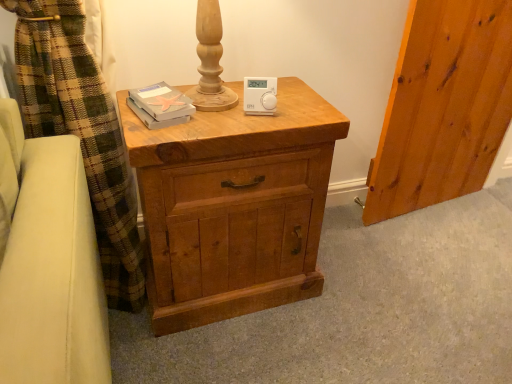
The height and width of the screenshot is (384, 512). Find the location of `vacant space to the right of matte wood chest of drawers at center`. vacant space to the right of matte wood chest of drawers at center is located at coordinates (350, 305).